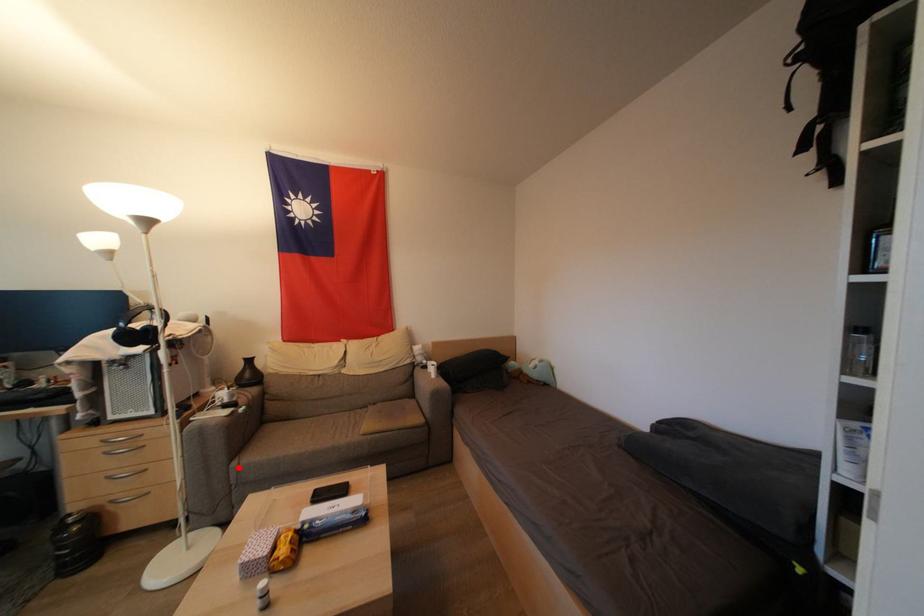
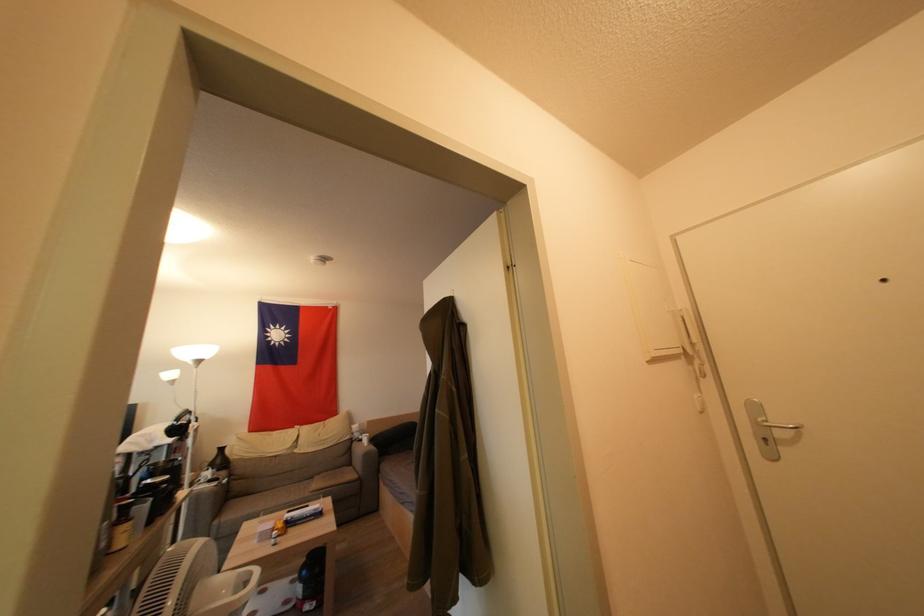
Question: I am providing you with two images of the same scene from different viewpoints. A red point is marked on the first image. Can you still see the location of the red point in image 2?

Choices:
 (A) Yes
 (B) No

Answer: (A)